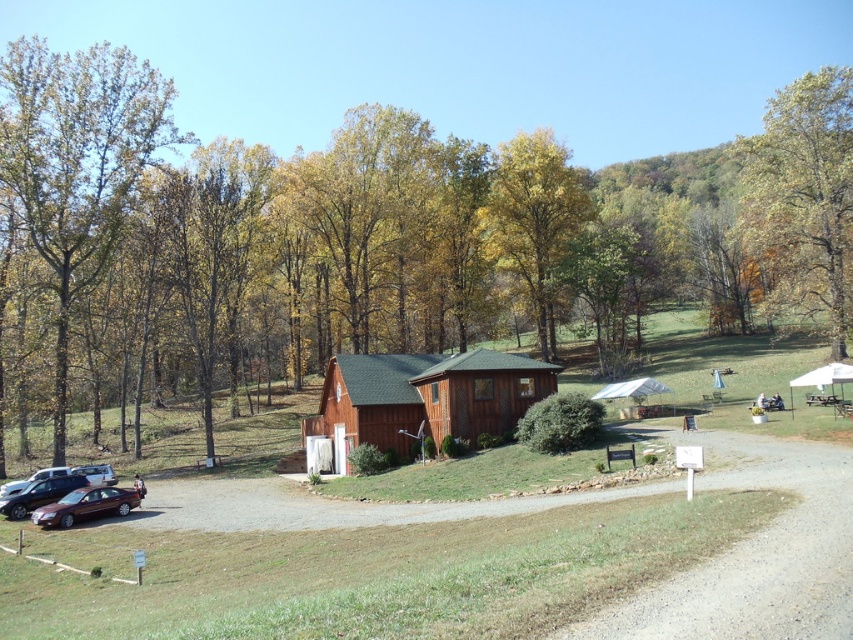
You are standing at the point labeled point (463, 563) in the image. What object are you directly facing?

The point labeled point (463, 563) directly faces the wooden cabin at center.

You are planning to build a small shed in your backyard and want to ensure it won t block the view of the green leafy tree at left from the wooden cabin at center. Based on the scene, which object is bigger and might affect the visibility?

The wooden cabin at center is larger than the green leafy tree at left, so it might block the view of the tree if not positioned carefully.